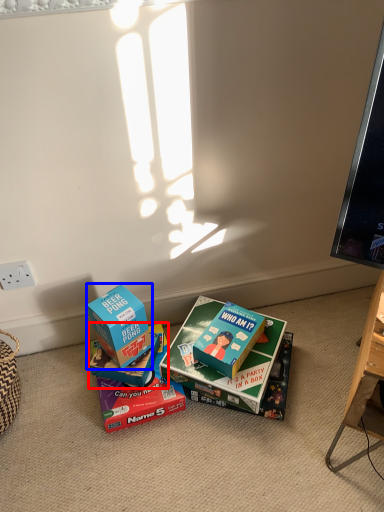
Question: Which of the following is the closest to the observer, box (highlighted by a red box) or box (highlighted by a blue box)?

Choices:
 (A) box
 (B) box

Answer: (B)